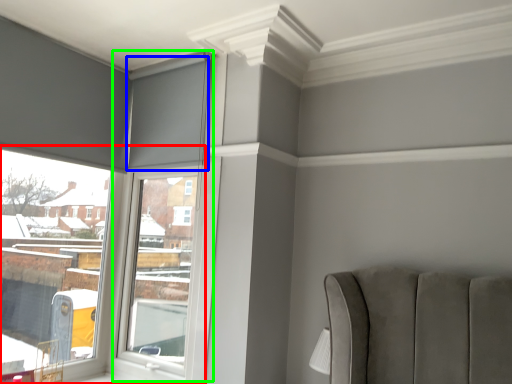
Question: Which object is positioned farthest from window (highlighted by a red box)? Select from curtain (highlighted by a blue box) and window frame (highlighted by a green box).

Choices:
 (A) curtain
 (B) window frame

Answer: (A)